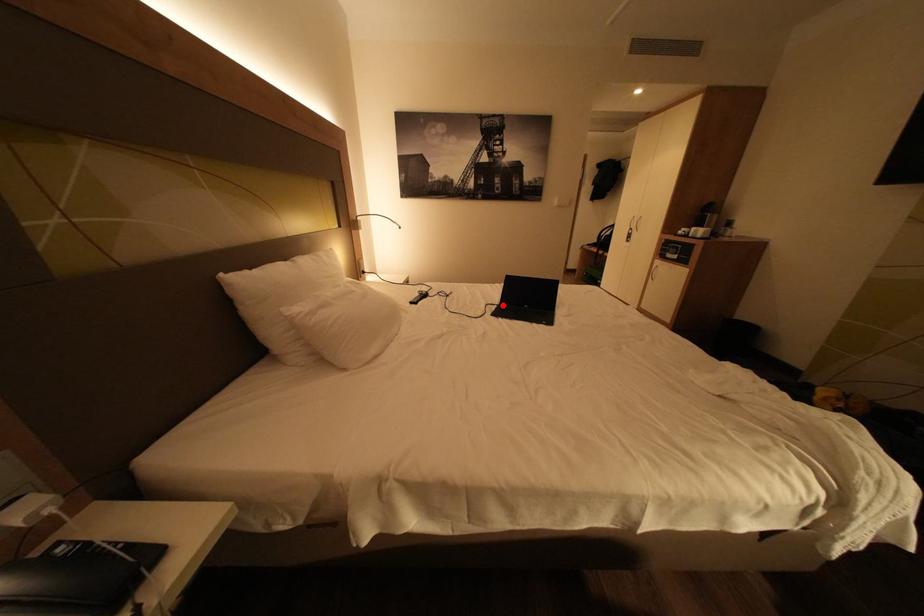
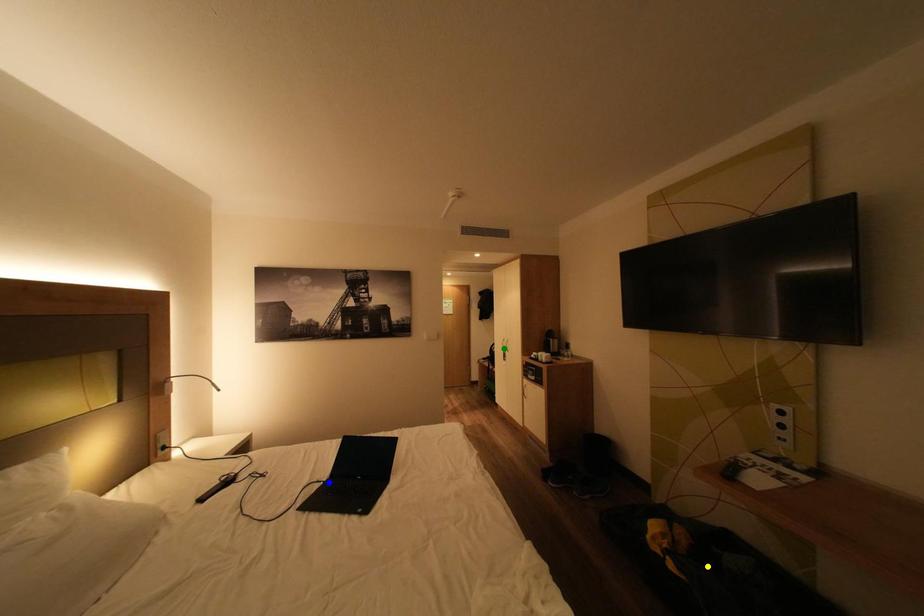
Question: I am providing you with two images of the same scene from different viewpoints. A red point is marked on the first image. You are given multiple points on the second image. Can you choose the point in image 2 that corresponds to the point in image 1?

Choices:
 (A) yellow point
 (B) blue point
 (C) green point

Answer: (B)